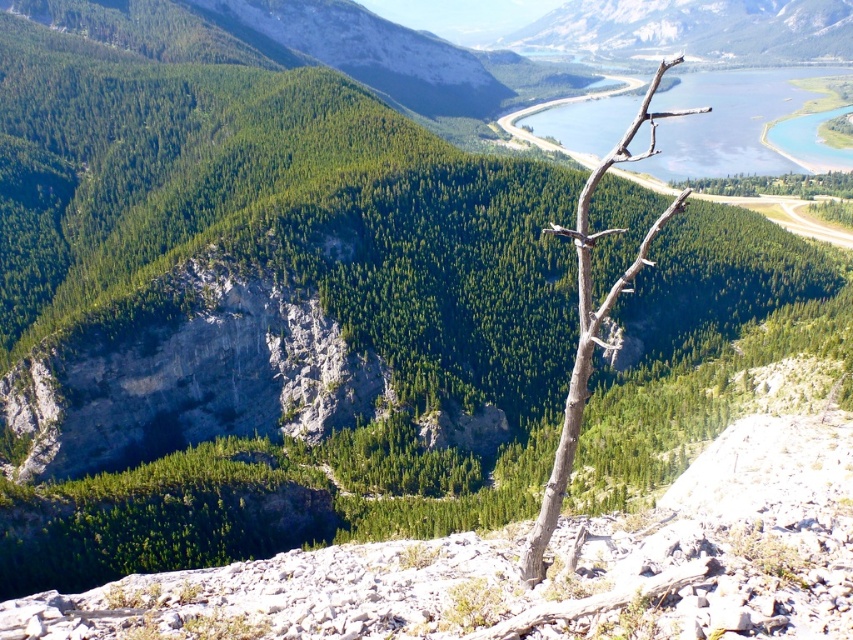
Question: Which point is farther to the camera?

Choices:
 (A) (584, 38)
 (B) (578, 257)

Answer: (A)

Question: Is blue water at upper right in front of brown rough branch at center?

Choices:
 (A) yes
 (B) no

Answer: (B)

Question: Does green forested mountain at upper right have a lesser width compared to brown rough branch at center?

Choices:
 (A) no
 (B) yes

Answer: (A)

Question: Is blue water at upper right thinner than green forested mountain at upper right?

Choices:
 (A) yes
 (B) no

Answer: (A)

Question: Which of the following is the closest to the observer?

Choices:
 (A) (757, 131)
 (B) (546, 32)
 (C) (607, 157)

Answer: (C)

Question: Which object is the farthest from the brown rough branch at center?

Choices:
 (A) green forested mountain at upper right
 (B) blue water at upper right

Answer: (A)